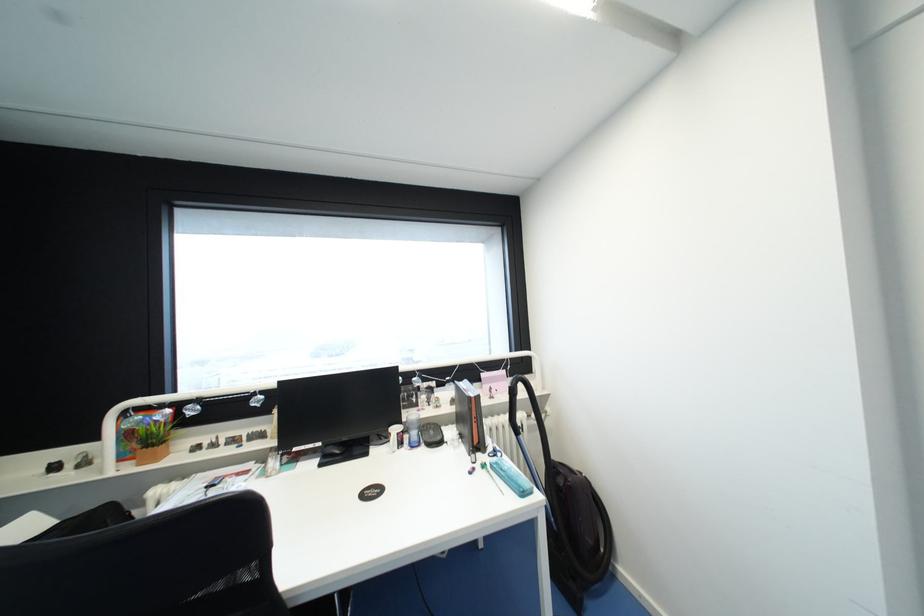
Locate an element on the screen. This screenshot has width=924, height=616. grey computer mouse is located at coordinates pyautogui.click(x=333, y=448).